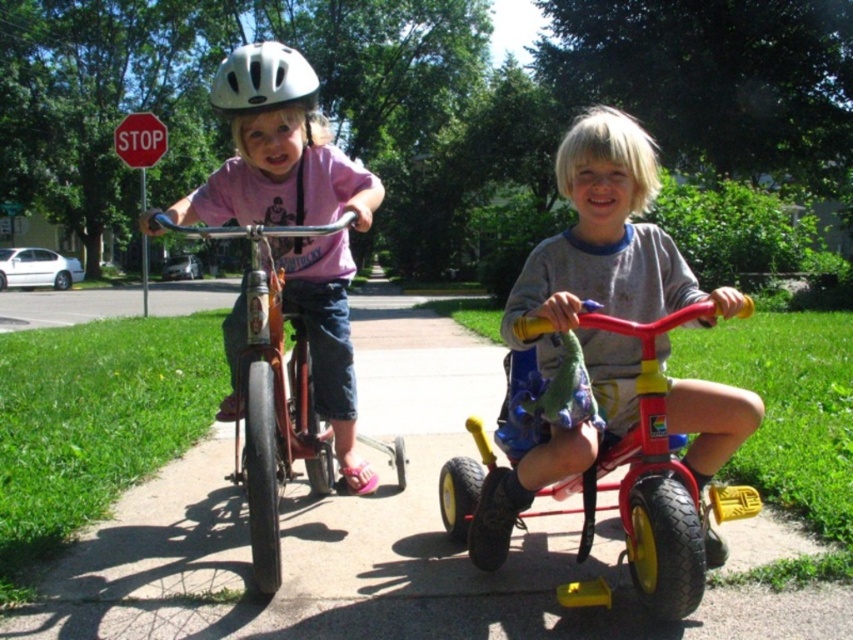
Question: Is smooth concrete pavement at center positioned before orange matte bicycle at left?

Choices:
 (A) no
 (B) yes

Answer: (A)

Question: Is smooth concrete pavement at center bigger than matte red tricycle at center?

Choices:
 (A) yes
 (B) no

Answer: (B)

Question: Which is farther from the red plastic stop sign at upper left?

Choices:
 (A) orange matte bicycle at left
 (B) white matte helmet at upper center

Answer: (A)

Question: Which point is farther to the camera?

Choices:
 (A) (283, 228)
 (B) (129, 145)
 (C) (344, 508)

Answer: (B)

Question: Where is smooth concrete pavement at center located in relation to matte red tricycle at center in the image?

Choices:
 (A) below
 (B) above

Answer: (A)

Question: Which point is closer to the camera taking this photo?

Choices:
 (A) (155, 124)
 (B) (654, 148)
 (C) (248, 109)
 (D) (274, 570)

Answer: (D)